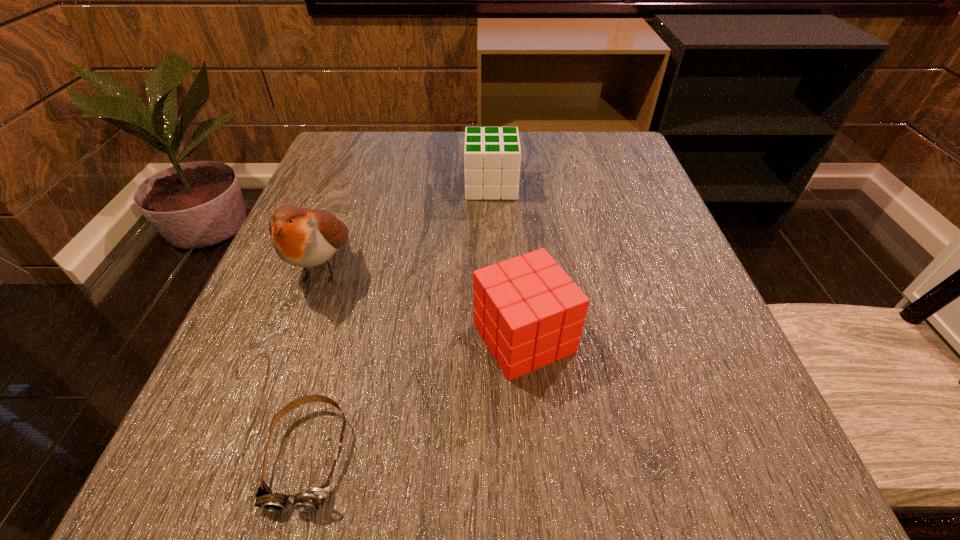
Where is `vacant space at the far right corner of the desktop`? vacant space at the far right corner of the desktop is located at coordinates pos(585,141).

Where is `vacant space at the near right corner of the desktop`? This screenshot has width=960, height=540. vacant space at the near right corner of the desktop is located at coordinates (793, 500).

The image size is (960, 540). Find the location of `free space between the shortest object and the nearer cube`. free space between the shortest object and the nearer cube is located at coordinates (417, 396).

The image size is (960, 540). What are the coordinates of `empty space between the farther cube and the bird` in the screenshot? It's located at (407, 227).

Where is `vacant space that's between the farthest object and the goggles`? vacant space that's between the farthest object and the goggles is located at coordinates (400, 320).

Identify the location of free space between the bird and the shortest object. This screenshot has height=540, width=960. (316, 361).

Identify the location of vacant region between the nearer cube and the goggles. The image size is (960, 540). (417, 396).

Find the location of `unoccupied area between the farthest object and the bird`. unoccupied area between the farthest object and the bird is located at coordinates (407, 227).

Locate an element on the screen. free space between the goggles and the nearer cube is located at coordinates (417, 396).

Image resolution: width=960 pixels, height=540 pixels. I want to click on object that is the third closest to the shortest object, so click(x=492, y=156).